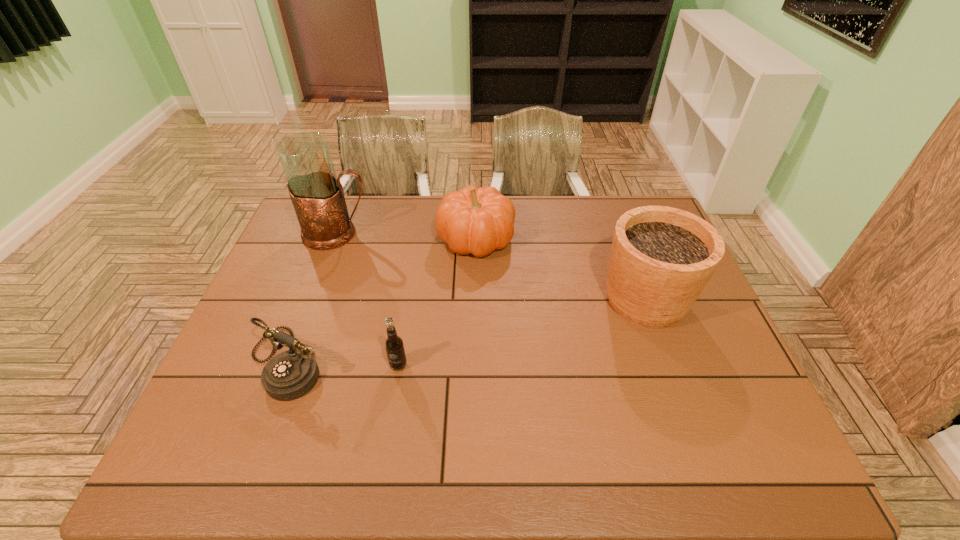
This screenshot has width=960, height=540. Identify the location of vacant space at the right edge of the desktop. [x=710, y=375].

Identify the location of unoccupied position between the fourth object from left to right and the pitcher. (407, 237).

You are a GUI agent. You are given a task and a screenshot of the screen. Output one action in this format:
    pyautogui.click(x=<x>, y=<y>)
    Task: Click on the vacant space that is in between the tallest object and the pumpkin
    
    Given the screenshot: What is the action you would take?
    pyautogui.click(x=407, y=237)

Image resolution: width=960 pixels, height=540 pixels. I want to click on empty space between the telephone and the pitcher, so click(x=314, y=298).

At what (x,y) coordinates should I click in order to perform the action: click on vacant area that lies between the second tallest object and the tallest object. Please return your answer as a coordinate pair (x, y). The height and width of the screenshot is (540, 960). Looking at the image, I should click on (492, 267).

What are the coordinates of `empty space that is in between the rightmost object and the pitcher` in the screenshot? It's located at (492, 267).

Identify the location of free space between the flowerpot and the tallest object. The image size is (960, 540). (x=492, y=267).

Identify the location of free space between the pitcher and the shortest object. 314,298.

Where is `vacant space that's between the pitcher and the fourth shortest object`? This screenshot has width=960, height=540. vacant space that's between the pitcher and the fourth shortest object is located at coordinates (492, 267).

You are a GUI agent. You are given a task and a screenshot of the screen. Output one action in this format:
    pyautogui.click(x=<x>, y=<y>)
    Task: Click on the vacant region between the shortest object and the root beer
    The width and height of the screenshot is (960, 540).
    Given the screenshot: What is the action you would take?
    pyautogui.click(x=344, y=363)